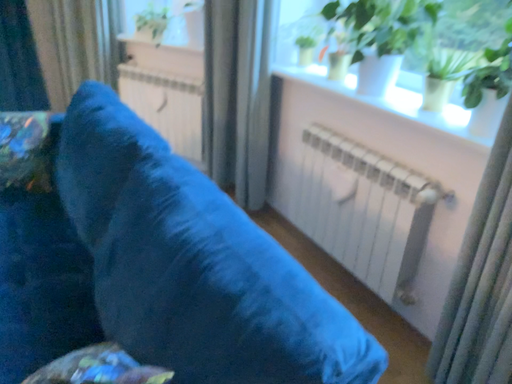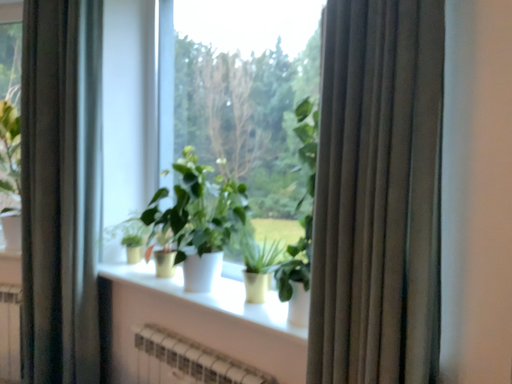
Question: How did the camera likely rotate when shooting the video?

Choices:
 (A) rotated right
 (B) rotated left

Answer: (A)